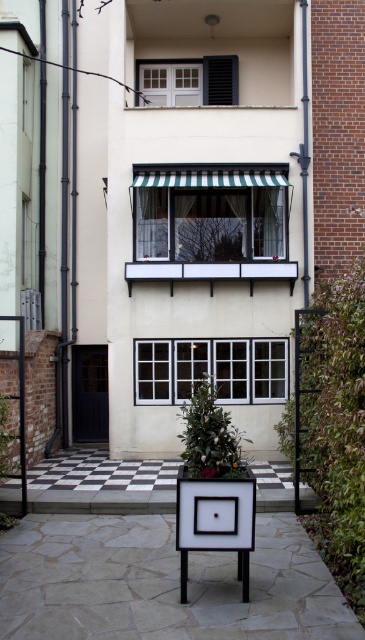
Between white painted wood shed at center and green striped awning at center, which one appears on the left side from the viewer's perspective?

green striped awning at center

Does white painted wood shed at center appear on the right side of green striped awning at center?

Yes, white painted wood shed at center is to the right of green striped awning at center.

At what (x,y) coordinates should I click in order to perform the action: click on white painted wood shed at center. Please return your answer as a coordinate pair (x, y). Looking at the image, I should click on (205, 216).

Image resolution: width=365 pixels, height=640 pixels. What are the coordinates of `white painted wood shed at center` in the screenshot? It's located at (205, 216).